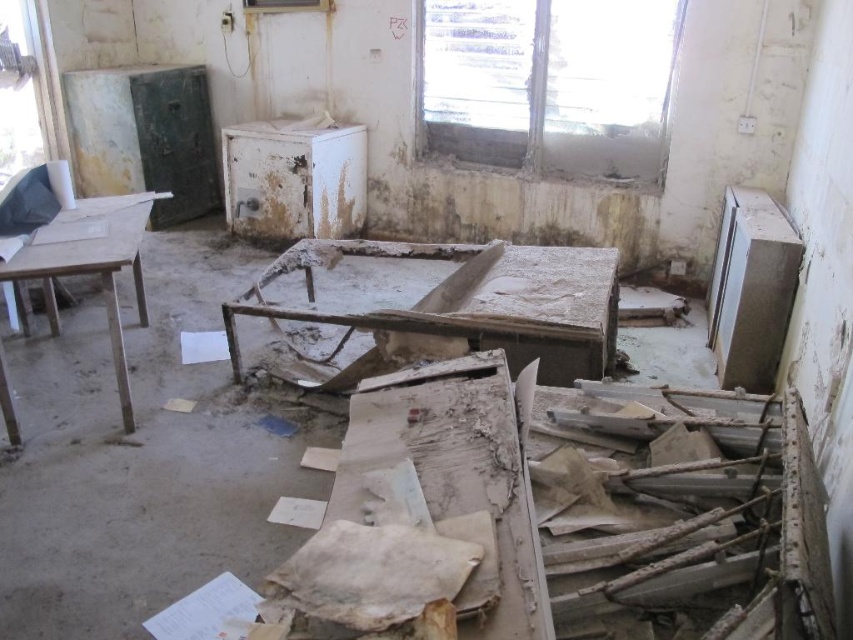
Does dirty wooden table at center have a larger size compared to wooden table at left?

Yes, dirty wooden table at center is bigger than wooden table at left.

Does dirty wooden table at center appear over wooden table at left?

No.

This screenshot has width=853, height=640. Describe the element at coordinates (466, 304) in the screenshot. I see `dirty wooden table at center` at that location.

I want to click on dirty wooden table at center, so click(x=466, y=304).